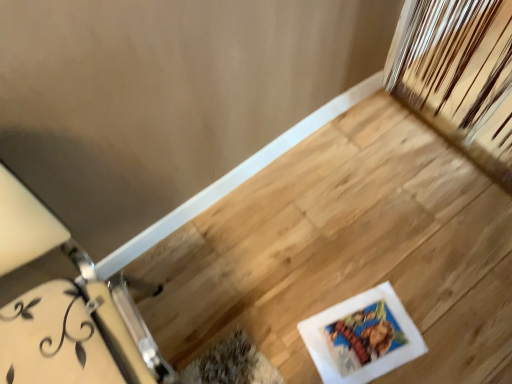
You are a GUI agent. You are given a task and a screenshot of the screen. Output one action in this format:
    pyautogui.click(x=<x>, y=<y>)
    Task: Click on the vacant region above white glossy picture frame at lower right (from a real-world perspective)
    Image resolution: width=512 pixels, height=384 pixels.
    Given the screenshot: What is the action you would take?
    pyautogui.click(x=368, y=333)